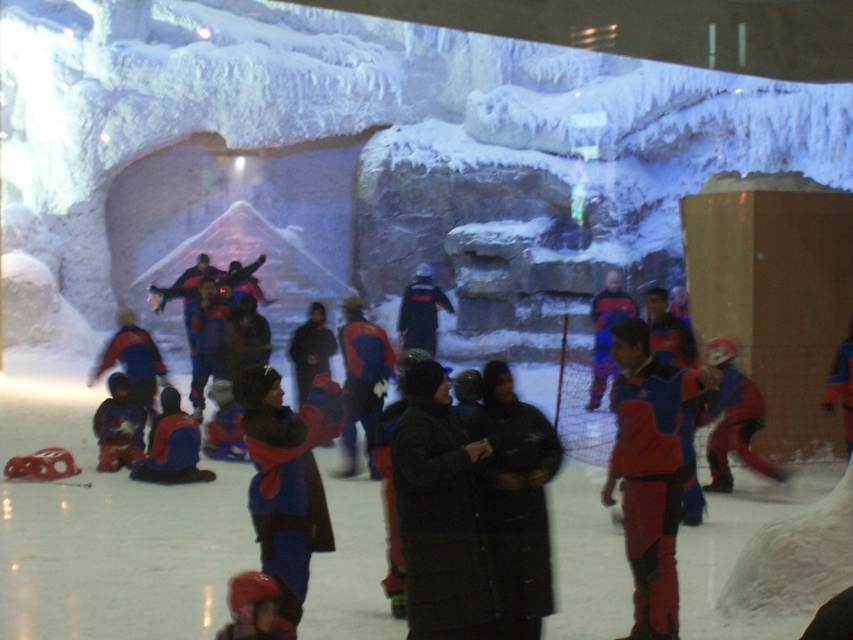
You are a photographer at the indoor ice skating rink. You want to take a photo of the matte blue jacket at lower left. Where should you position your camera to capture it in the frame?

To capture the matte blue jacket at lower left in the frame, position your camera at point (171, 445).

You are an instructor at the ice rink and need to check the equipment of the participants. You see a participant wearing a matte blue snowsuit at lower left and a matte red helmet at lower left. Which piece of equipment is positioned more to the left?

The matte blue snowsuit at lower left is positioned more to the left than the matte red helmet at lower left.

You are a photographer taking a picture of the matte blue ski suit at center and the matte red helmet at lower left. Which object should you focus on first if you want to capture both in the same frame without moving the camera?

The matte blue ski suit at center is positioned on the right side of the matte red helmet at lower left, so you should focus on the matte red helmet at lower left first to ensure both are in frame.